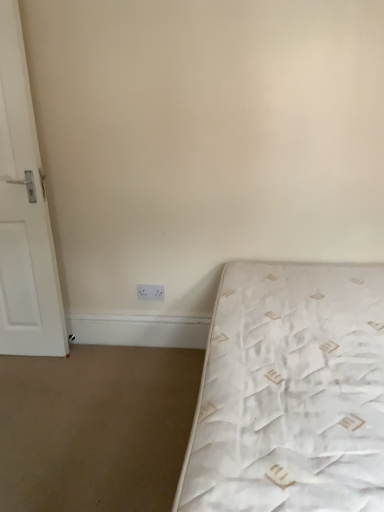
Question: Could you tell me if white plastic electric outlet at lower center is facing white quilted mattress at lower right?

Choices:
 (A) yes
 (B) no

Answer: (B)

Question: Is white plastic electric outlet at lower center taller than white quilted mattress at lower right?

Choices:
 (A) no
 (B) yes

Answer: (A)

Question: Is white plastic electric outlet at lower center at the right side of white quilted mattress at lower right?

Choices:
 (A) yes
 (B) no

Answer: (B)

Question: Is white plastic electric outlet at lower center shorter than white quilted mattress at lower right?

Choices:
 (A) no
 (B) yes

Answer: (B)

Question: Does white plastic electric outlet at lower center have a larger size compared to white quilted mattress at lower right?

Choices:
 (A) yes
 (B) no

Answer: (B)

Question: Does white plastic electric outlet at lower center have a greater width compared to white quilted mattress at lower right?

Choices:
 (A) no
 (B) yes

Answer: (A)

Question: Considering the relative sizes of white quilted mattress at lower right and white matte door at left in the image provided, is white quilted mattress at lower right bigger than white matte door at left?

Choices:
 (A) no
 (B) yes

Answer: (B)

Question: From the image's perspective, does white quilted mattress at lower right appear higher than white matte door at left?

Choices:
 (A) yes
 (B) no

Answer: (B)

Question: Can you confirm if white quilted mattress at lower right is thinner than white matte door at left?

Choices:
 (A) no
 (B) yes

Answer: (A)

Question: Does white quilted mattress at lower right turn towards white matte door at left?

Choices:
 (A) yes
 (B) no

Answer: (B)

Question: Does white quilted mattress at lower right have a greater height compared to white matte door at left?

Choices:
 (A) yes
 (B) no

Answer: (B)

Question: Can you confirm if white quilted mattress at lower right is wider than white matte door at left?

Choices:
 (A) yes
 (B) no

Answer: (A)

Question: Considering the relative sizes of white quilted mattress at lower right and white plastic electric outlet at lower center in the image provided, is white quilted mattress at lower right wider than white plastic electric outlet at lower center?

Choices:
 (A) yes
 (B) no

Answer: (A)